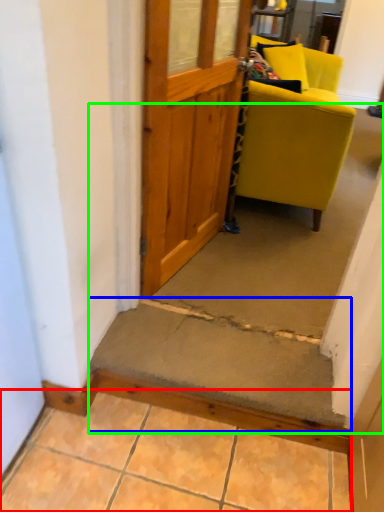
Question: Which object is positioned closest to concrete (highlighted by a red box)? Select from stairwell (highlighted by a blue box) and stairwell (highlighted by a green box).

Choices:
 (A) stairwell
 (B) stairwell

Answer: (A)